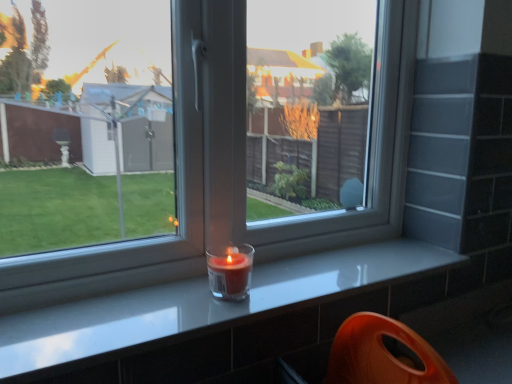
The width and height of the screenshot is (512, 384). Find the location of `free spot to the right of translucent glass candle at window`. free spot to the right of translucent glass candle at window is located at coordinates pos(295,283).